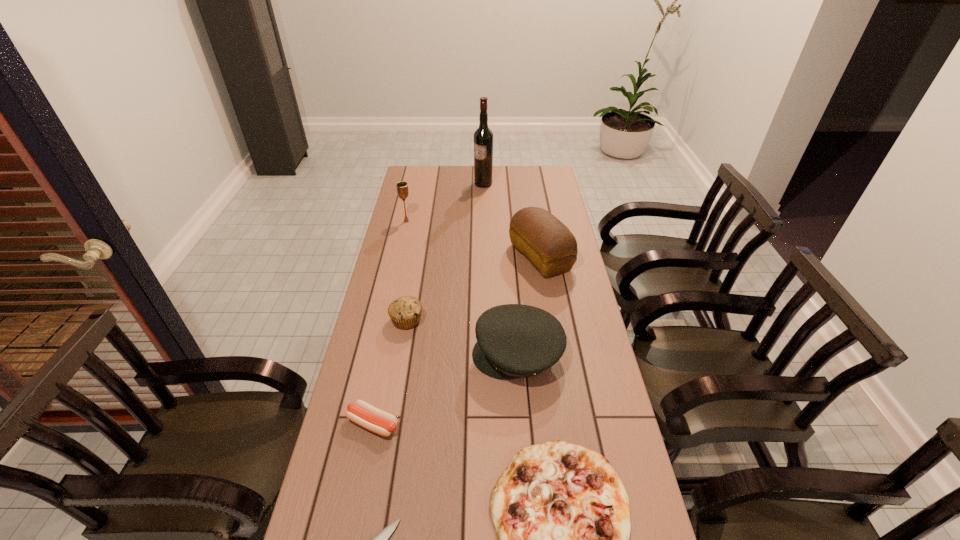
What are the coordinates of `sausage positioned at the left edge` in the screenshot? It's located at (369, 417).

You are a GUI agent. You are given a task and a screenshot of the screen. Output one action in this format:
    pyautogui.click(x=<x>, y=<y>)
    Task: Click on the bread located at the right edge
    This screenshot has height=540, width=960.
    Given the screenshot: What is the action you would take?
    pyautogui.click(x=549, y=245)

In order to click on beret located at the right edge in this screenshot , I will do `click(514, 341)`.

Identify the location of free space at the far edge of the desktop. Image resolution: width=960 pixels, height=540 pixels. (506, 177).

You are a GUI agent. You are given a task and a screenshot of the screen. Output one action in this format:
    pyautogui.click(x=<x>, y=<y>)
    Task: Click on the vacant area at the left edge
    
    Given the screenshot: What is the action you would take?
    pyautogui.click(x=387, y=488)

Where is `free space at the right edge of the desktop`? The width and height of the screenshot is (960, 540). free space at the right edge of the desktop is located at coordinates (556, 292).

At what (x,y) coordinates should I click in order to perform the action: click on vacant space at the far right corner of the desktop. Please return your answer as a coordinate pair (x, y). The width and height of the screenshot is (960, 540). Looking at the image, I should click on coord(545,180).

The image size is (960, 540). What are the coordinates of `free area in between the beret and the tallest object` in the screenshot? It's located at (500, 269).

Where is `vacant area between the chalice and the bread`? Image resolution: width=960 pixels, height=540 pixels. vacant area between the chalice and the bread is located at coordinates coord(473,239).

You are a GUI agent. You are given a task and a screenshot of the screen. Output one action in this format:
    pyautogui.click(x=<x>, y=<y>)
    Task: Click on the free space between the fifth tallest object and the wine bottle
    The image size is (960, 540).
    Given the screenshot: What is the action you would take?
    pyautogui.click(x=444, y=252)